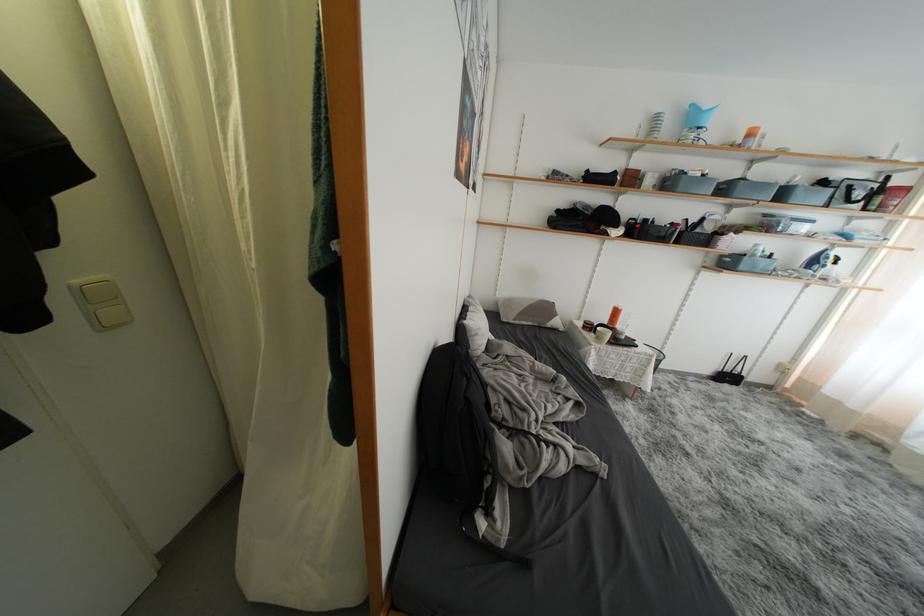
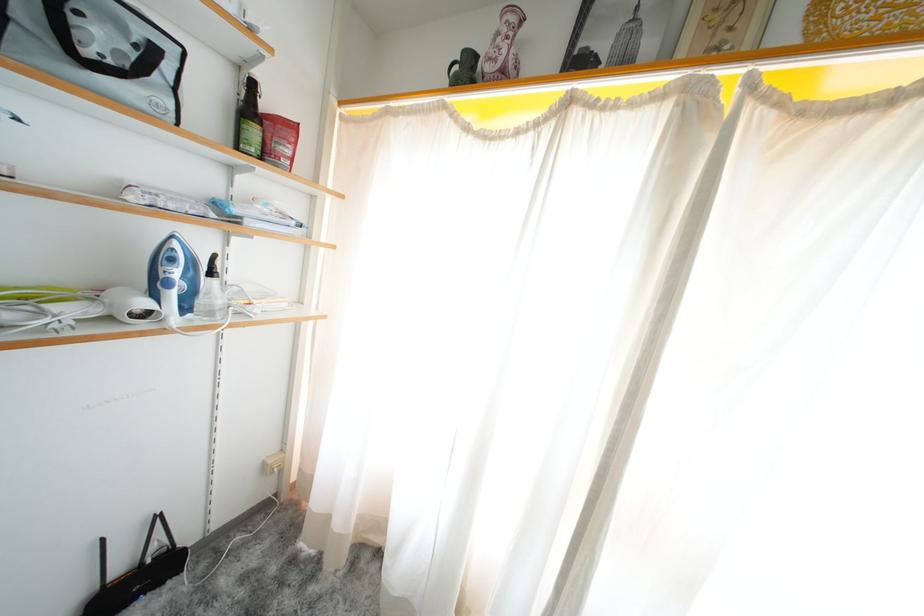
In the second image, find the point that corresponds to pixel 885 204 in the first image.

(261, 137)